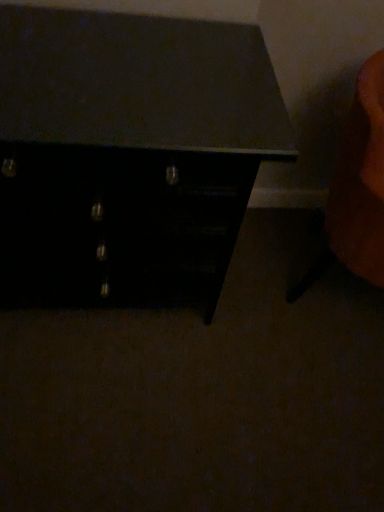
Question: Is point (152, 270) closer or farther from the camera than point (340, 160)?

Choices:
 (A) closer
 (B) farther

Answer: (B)

Question: In terms of height, does matte black chest of drawers at center look taller or shorter compared to orange fabric swivel chair at right?

Choices:
 (A) tall
 (B) short

Answer: (A)

Question: Is matte black chest of drawers at center inside the boundaries of orange fabric swivel chair at right, or outside?

Choices:
 (A) inside
 (B) outside

Answer: (B)

Question: Considering the positions of point (382, 254) and point (61, 143), is point (382, 254) closer or farther from the camera than point (61, 143)?

Choices:
 (A) closer
 (B) farther

Answer: (B)

Question: Choose the correct answer: Is orange fabric swivel chair at right inside matte black chest of drawers at center or outside it?

Choices:
 (A) outside
 (B) inside

Answer: (A)

Question: Considering the positions of orange fabric swivel chair at right and matte black chest of drawers at center in the image, is orange fabric swivel chair at right wider or thinner than matte black chest of drawers at center?

Choices:
 (A) thin
 (B) wide

Answer: (A)

Question: From a real-world perspective, relative to matte black chest of drawers at center, is orange fabric swivel chair at right vertically above or below?

Choices:
 (A) below
 (B) above

Answer: (A)